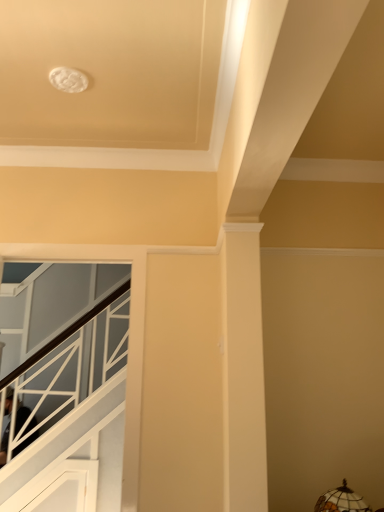
Question: From the image's perspective, would you say white glossy stairwell at left is shown under stained glass lampshade at lower right?

Choices:
 (A) yes
 (B) no

Answer: (A)

Question: Does white glossy stairwell at left have a lesser height compared to stained glass lampshade at lower right?

Choices:
 (A) yes
 (B) no

Answer: (B)

Question: Considering the relative positions of white glossy stairwell at left and stained glass lampshade at lower right in the image provided, is white glossy stairwell at left to the left of stained glass lampshade at lower right from the viewer's perspective?

Choices:
 (A) no
 (B) yes

Answer: (B)

Question: Is white glossy stairwell at left taller than stained glass lampshade at lower right?

Choices:
 (A) no
 (B) yes

Answer: (B)

Question: Does white glossy stairwell at left have a greater width compared to stained glass lampshade at lower right?

Choices:
 (A) yes
 (B) no

Answer: (B)

Question: Could you tell me if white glossy stairwell at left is turned towards stained glass lampshade at lower right?

Choices:
 (A) yes
 (B) no

Answer: (B)

Question: From a real-world perspective, is stained glass lampshade at lower right located higher than white glossy stairwell at left?

Choices:
 (A) yes
 (B) no

Answer: (B)

Question: Does stained glass lampshade at lower right lie behind white glossy stairwell at left?

Choices:
 (A) no
 (B) yes

Answer: (A)

Question: Considering the relative sizes of stained glass lampshade at lower right and white glossy stairwell at left in the image provided, is stained glass lampshade at lower right shorter than white glossy stairwell at left?

Choices:
 (A) yes
 (B) no

Answer: (A)

Question: Is white glossy stairwell at left at the back of stained glass lampshade at lower right?

Choices:
 (A) no
 (B) yes

Answer: (A)

Question: Is stained glass lampshade at lower right surrounding white glossy stairwell at left?

Choices:
 (A) no
 (B) yes

Answer: (A)

Question: Can we say stained glass lampshade at lower right lies outside white glossy stairwell at left?

Choices:
 (A) no
 (B) yes

Answer: (B)

Question: Considering the positions of white glossy stairwell at left and stained glass lampshade at lower right in the image, is white glossy stairwell at left taller or shorter than stained glass lampshade at lower right?

Choices:
 (A) short
 (B) tall

Answer: (B)